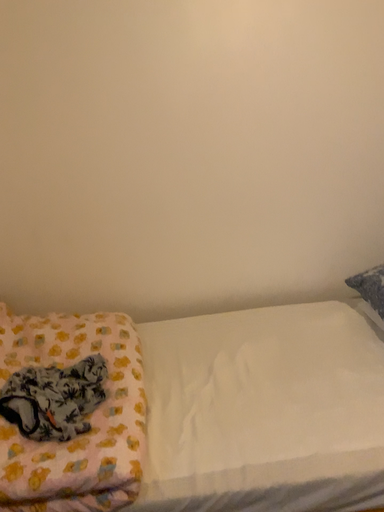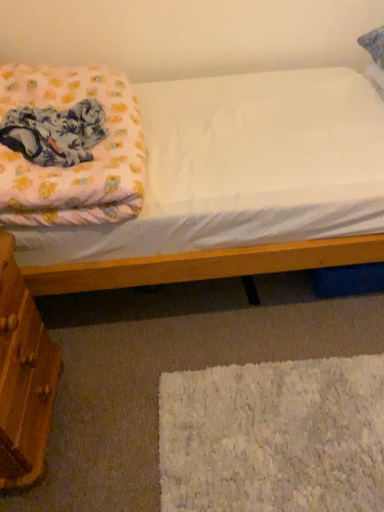
Question: Which way did the camera rotate in the video?

Choices:
 (A) rotated upward
 (B) rotated downward

Answer: (B)